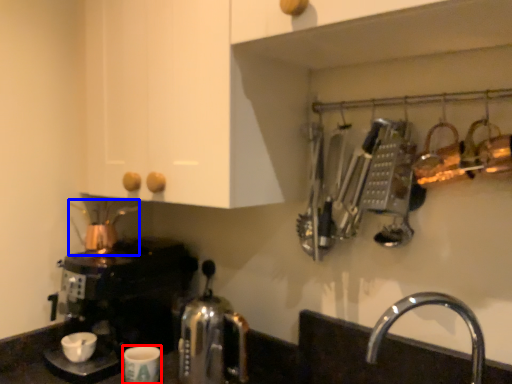
Question: Which point is closer to the camera, coffee cup (highlighted by a red box) or tea pot (highlighted by a blue box)?

Choices:
 (A) coffee cup
 (B) tea pot

Answer: (A)